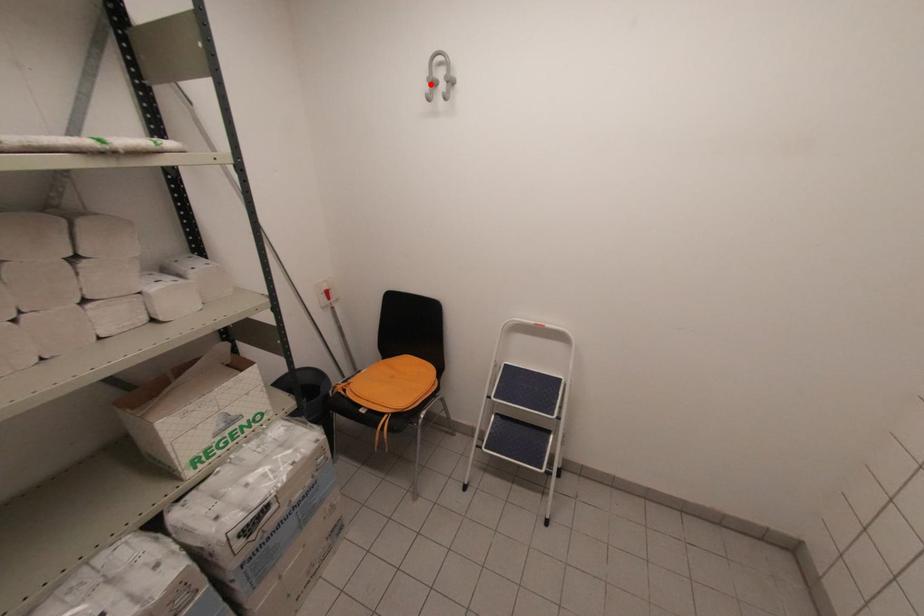
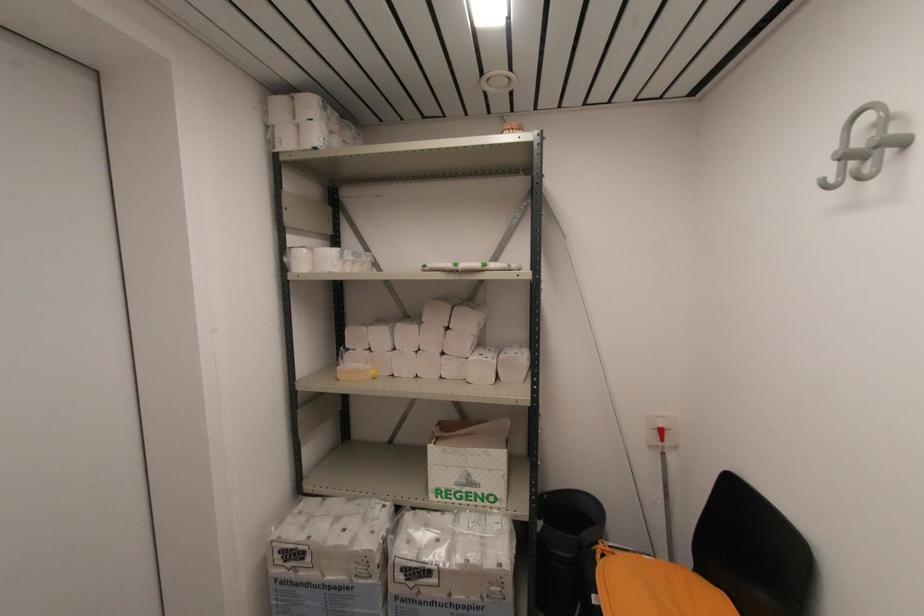
Question: I am providing you with two images of the same scene from different viewpoints. A red point is marked on the first image. At the location where the point appears in image 1, is it still visible in image 2?

Choices:
 (A) Yes
 (B) No

Answer: (A)